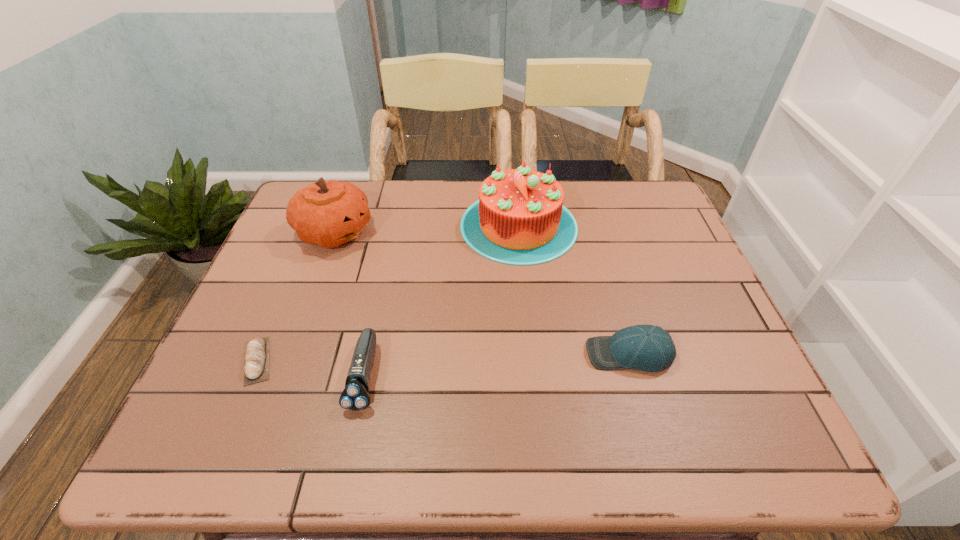
You are a GUI agent. You are given a task and a screenshot of the screen. Output one action in this format:
    pyautogui.click(x=<x>, y=<y>)
    Task: Click on the pumpkin situated at the far edge
    This screenshot has width=960, height=540.
    Given the screenshot: What is the action you would take?
    pyautogui.click(x=329, y=213)

The image size is (960, 540). I want to click on pumpkin located at the left edge, so click(x=329, y=213).

At what (x,y) coordinates should I click in order to perform the action: click on pita bread that is at the left edge. Please return your answer as a coordinate pair (x, y). Looking at the image, I should click on (256, 367).

At what (x,y) coordinates should I click in order to perform the action: click on object present at the right edge. Please return your answer as a coordinate pair (x, y). Image resolution: width=960 pixels, height=540 pixels. Looking at the image, I should click on (650, 348).

Identify the location of object that is at the far left corner. The height and width of the screenshot is (540, 960). (329, 213).

This screenshot has height=540, width=960. What are the coordinates of `blank space at the far edge of the desktop` in the screenshot? It's located at (596, 207).

Identify the location of vacant area at the near edge of the desktop. (562, 422).

At what (x,y) coordinates should I click in order to perform the action: click on free space at the left edge. Please return your answer as a coordinate pair (x, y). This screenshot has width=960, height=540. Looking at the image, I should click on (268, 407).

Locate an element on the screen. The height and width of the screenshot is (540, 960). vacant space at the right edge is located at coordinates (740, 389).

Find the location of a particular element. The width and height of the screenshot is (960, 540). free space at the near left corner of the desktop is located at coordinates (240, 416).